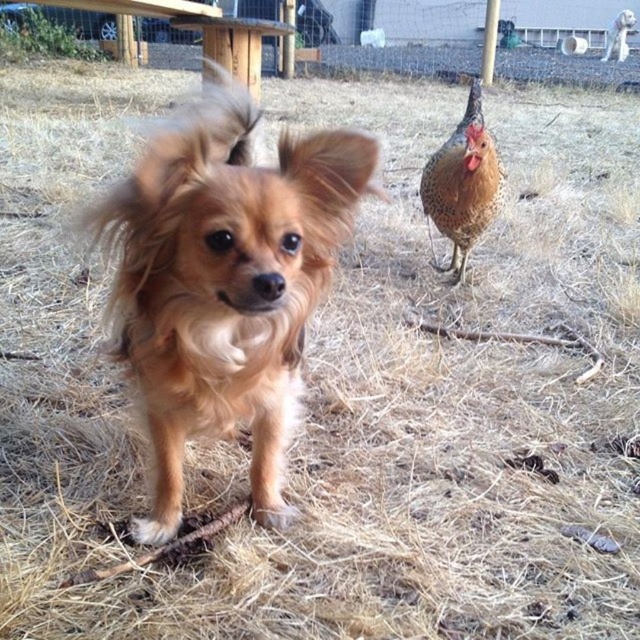
Question: Which of the following is the farthest from the observer?

Choices:
 (A) brown fluffy dog at center
 (B) brown speckled feathers at upper right

Answer: (B)

Question: Where is brown fluffy dog at center located in relation to brown speckled feathers at upper right in the image?

Choices:
 (A) below
 (B) above

Answer: (A)

Question: Is brown fluffy dog at center bigger than brown speckled feathers at upper right?

Choices:
 (A) yes
 (B) no

Answer: (A)

Question: Can you confirm if brown fluffy dog at center is positioned to the left of brown speckled feathers at upper right?

Choices:
 (A) no
 (B) yes

Answer: (B)

Question: Which point is farther to the camera?

Choices:
 (A) brown fluffy dog at center
 (B) brown speckled feathers at upper right

Answer: (B)